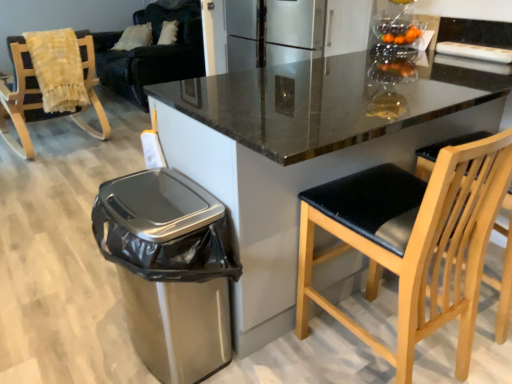
Question: Considering their positions, is dark blue fabric couch at upper left located in front of or behind black leather chair at right, the 2th chair viewed from the top?

Choices:
 (A) front
 (B) behind

Answer: (B)

Question: Choose the correct answer: Is dark blue fabric couch at upper left inside black leather chair at right, positioned as the first chair in right-to-left order, or outside it?

Choices:
 (A) inside
 (B) outside

Answer: (B)

Question: Which of these objects is positioned farthest from the satin silver trash can at lower left?

Choices:
 (A) wooden rocking chair with fringed blanket at left, which is the 2th chair from bottom to top
 (B) granite countertop at center
 (C) dark blue fabric couch at upper left
 (D) black leather chair at right, arranged as the second chair when viewed from the back

Answer: (C)

Question: Which object is positioned farthest from the satin silver trash can at lower left?

Choices:
 (A) dark blue fabric couch at upper left
 (B) black leather chair at right, arranged as the second chair when viewed from the back
 (C) granite countertop at center
 (D) wooden rocking chair with fringed blanket at left, placed as the second chair when sorted from right to left

Answer: (A)